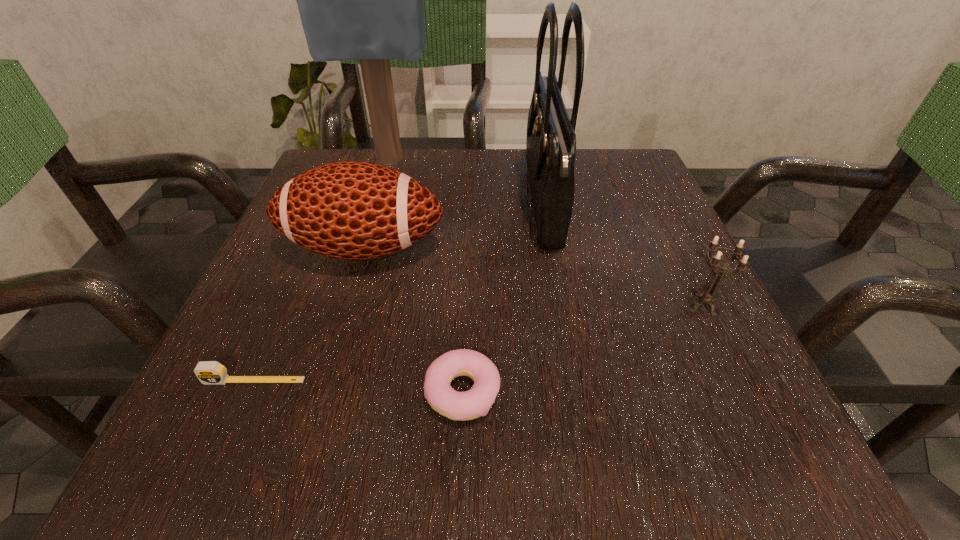
Find the location of a particular element. This screenshot has height=540, width=960. free location that satisfies the following two spatial constraints: 1. on the front side of the mallet; 2. on the right side of the fourth shortest object is located at coordinates (363, 248).

You are a GUI agent. You are given a task and a screenshot of the screen. Output one action in this format:
    pyautogui.click(x=<x>, y=<y>)
    Task: Click on the free space in the image that satisfies the following two spatial constraints: 1. on the back side of the doughnut; 2. on the right side of the third nearest object
    The width and height of the screenshot is (960, 540).
    Given the screenshot: What is the action you would take?
    pyautogui.click(x=466, y=305)

You are a GUI agent. You are given a task and a screenshot of the screen. Output one action in this format:
    pyautogui.click(x=<x>, y=<y>)
    Task: Click on the free spot that satisfies the following two spatial constraints: 1. at the front of the tape measure with the tape extended; 2. on the left side of the doughnut
    
    Given the screenshot: What is the action you would take?
    pyautogui.click(x=249, y=393)

This screenshot has width=960, height=540. I want to click on vacant area in the image that satisfies the following two spatial constraints: 1. with an open clasp on the front of the fifth object from left to right; 2. on the left side of the candle holder, so click(x=561, y=305).